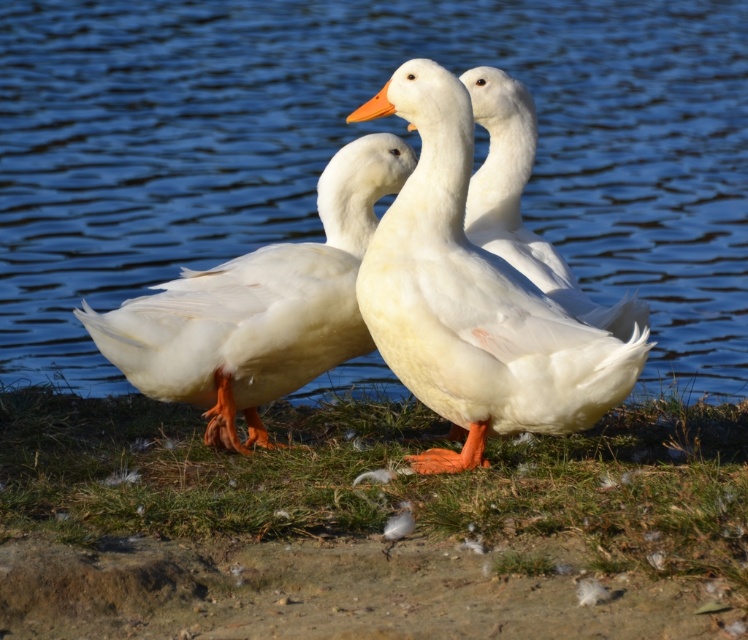
Question: From the image, what is the correct spatial relationship of blue water at center in relation to white matte duck at center?

Choices:
 (A) left
 (B) right

Answer: (A)

Question: Which object appears farthest from the camera in this image?

Choices:
 (A) white matte duck at center
 (B) green grass at center
 (C) white feathered goose at center

Answer: (C)

Question: Can you confirm if blue water at center is bigger than white feathered duck at center?

Choices:
 (A) no
 (B) yes

Answer: (B)

Question: Among these points, which one is nearest to the camera?

Choices:
 (A) (438, 419)
 (B) (678, 12)
 (C) (476, 369)

Answer: (C)

Question: Can you confirm if blue water at center is positioned below white feathered duck at center?

Choices:
 (A) yes
 (B) no

Answer: (B)

Question: Estimate the real-world distances between objects in this image. Which object is farther from the green grass at center?

Choices:
 (A) blue water at center
 (B) white matte duck at center
 (C) white feathered duck at center

Answer: (A)